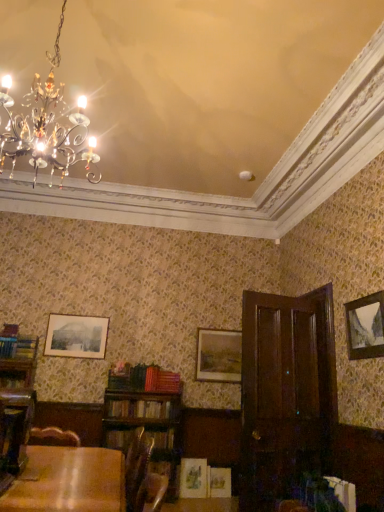
Question: Based on their positions, is dark wood armoire at right located to the left or right of matte black picture frame at upper left, placed as the 2th picture frame when sorted from back to front?

Choices:
 (A) right
 (B) left

Answer: (A)

Question: Considering the positions of dark wood armoire at right and matte black picture frame at upper left, which ranks as the second picture frame in front-to-back order, in the image, is dark wood armoire at right taller or shorter than matte black picture frame at upper left, which ranks as the second picture frame in front-to-back order,?

Choices:
 (A) short
 (B) tall

Answer: (B)

Question: Estimate the real-world distances between objects in this image. Which object is farther from the hardcover book at lower left, marked as the third book in a front-to-back arrangement?

Choices:
 (A) matte black picture frame at upper left, which ranks as the third picture frame in right-to-left order
 (B) wooden picture frame at right, the third picture frame in the back-to-front sequence
 (C) matte gold picture frame at center, arranged as the third picture frame when viewed from the front
 (D) white paper book at lower right, arranged as the fourth book when viewed from the back
 (E) hardcover book at center, acting as the second book starting from the left

Answer: (C)

Question: Which object is the closest to the matte black picture frame at upper left, acting as the first picture frame starting from the left?

Choices:
 (A) white paper book at lower right, which is the 4th book in left-to-right order
 (B) wooden table at lower left
 (C) matte gold picture frame at center, positioned as the first picture frame in back-to-front order
 (D) wooden picture frame at right, which is the 1th picture frame in front-to-back order
 (E) hardcover book at lower left, which is the 1th book from left to right

Answer: (C)